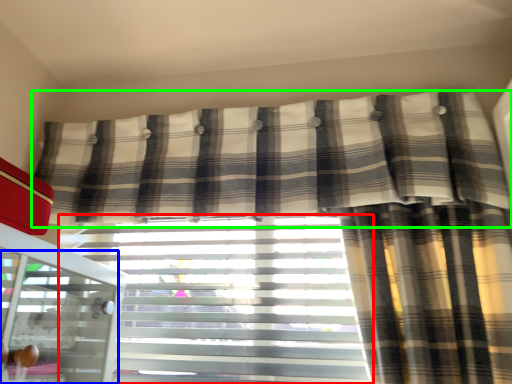
Question: Which object is positioned farthest from window blind (highlighted by a red box)? Select from screen door (highlighted by a blue box) and curtain (highlighted by a green box).

Choices:
 (A) screen door
 (B) curtain

Answer: (A)